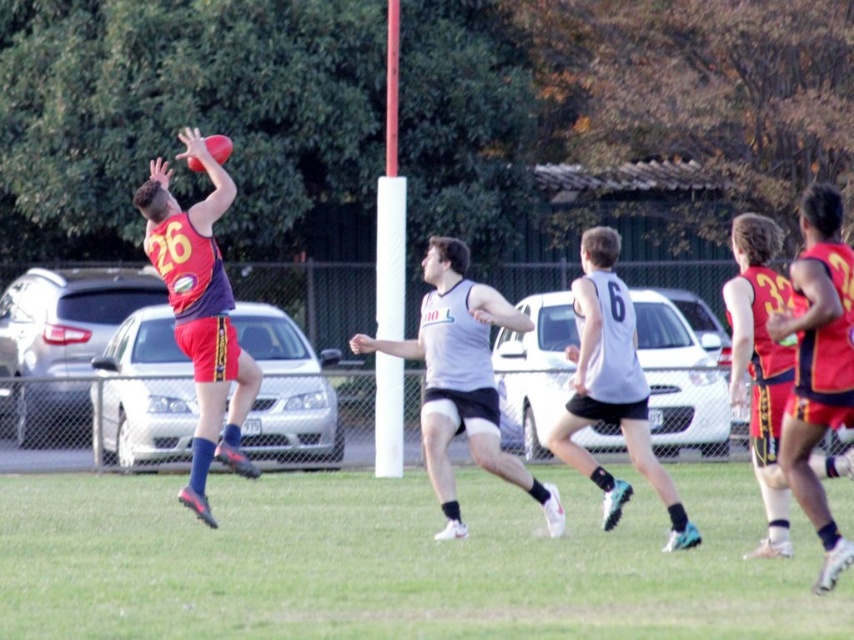
Does green grass at center appear on the right side of matte red jersey at left?

Yes, green grass at center is to the right of matte red jersey at left.

Does green grass at center come in front of matte red jersey at left?

Yes.

Identify the location of green grass at center. Image resolution: width=854 pixels, height=640 pixels. (395, 561).

Can you confirm if matte red jersey at left is positioned below white matte jersey at center?

Yes, matte red jersey at left is below white matte jersey at center.

What do you see at coordinates (200, 312) in the screenshot? The image size is (854, 640). I see `matte red jersey at left` at bounding box center [200, 312].

Find the location of a particular element. matte red jersey at left is located at coordinates (200, 312).

Based on the photo, can you confirm if green grass at center is wider than white matte jersey at center?

Correct, the width of green grass at center exceeds that of white matte jersey at center.

Between point (679, 595) and point (572, 282), which one is positioned behind?

Positioned behind is point (572, 282).

Is point (303, 609) farther from viewer compared to point (619, 346)?

No, it is in front of (619, 346).

In order to click on green grass at center in this screenshot , I will do `click(395, 561)`.